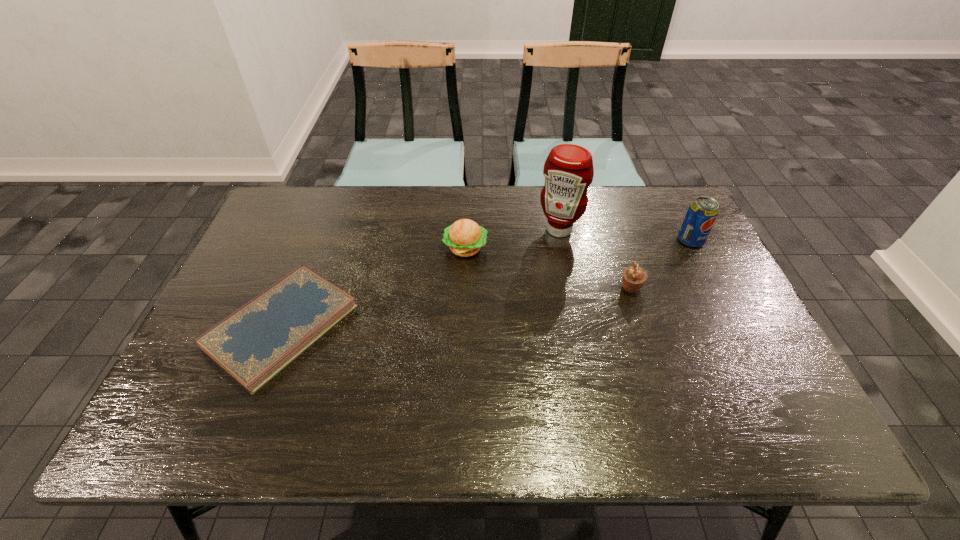
Where is `vacant space that's between the tallest object and the muffin`? vacant space that's between the tallest object and the muffin is located at coordinates (595, 259).

Locate an element on the screen. Image resolution: width=960 pixels, height=540 pixels. unoccupied position between the third object from left to right and the soda is located at coordinates (625, 235).

Locate an element on the screen. The width and height of the screenshot is (960, 540). object that stands as the third closest to the tallest object is located at coordinates tap(700, 217).

At what (x,y) coordinates should I click in order to perform the action: click on object that ranks as the third closest to the fourth object from left to right. Please return your answer as a coordinate pair (x, y). Looking at the image, I should click on [465, 237].

At what (x,y) coordinates should I click in order to perform the action: click on free spot that satisfies the following two spatial constraints: 1. on the front side of the muffin; 2. on the right side of the hamburger. Please return your answer as a coordinate pair (x, y). The height and width of the screenshot is (540, 960). Looking at the image, I should click on (464, 287).